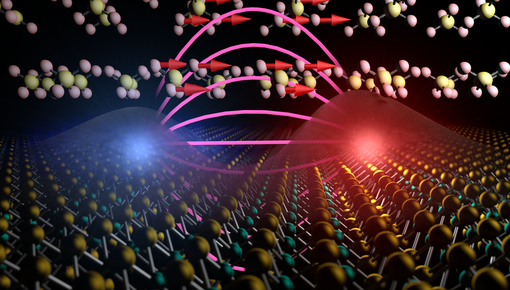
At what (x,y) coordinates should I click in order to perform the action: click on yellow light. Please return your answer as a coordinate pair (x, y). Looking at the image, I should click on (377, 78).